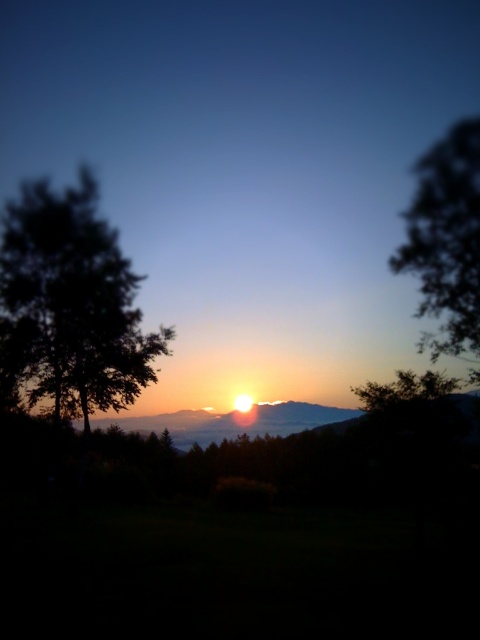
You are standing in the sunset scene and want to place a small decorative rock between the two points, point [105,269] and point [423,310]. Which point is closer to you where you should place the rock first?

Point [105,269] is closer to you than point [423,310], so you should place the rock closer to point [105,269] first.